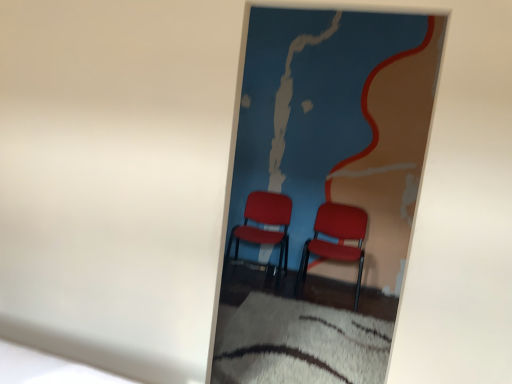
Question: From a real-world perspective, is matte plastic chairs at center above or below white shaggy rug at lower center?

Choices:
 (A) below
 (B) above

Answer: (B)

Question: In terms of size, does matte plastic chairs at center appear bigger or smaller than white shaggy rug at lower center?

Choices:
 (A) small
 (B) big

Answer: (B)

Question: Which object is positioned closest to the white shaggy rug at lower center?

Choices:
 (A) matte plastic chair at center, the 1th chair from the left
 (B) matte plastic chairs at center
 (C) matte red chair at center, arranged as the 2th chair when viewed from the left

Answer: (B)

Question: Which object is positioned farthest from the matte plastic chairs at center?

Choices:
 (A) matte plastic chair at center, the 1th chair from the left
 (B) white shaggy rug at lower center
 (C) matte red chair at center, arranged as the 2th chair when viewed from the left

Answer: (B)